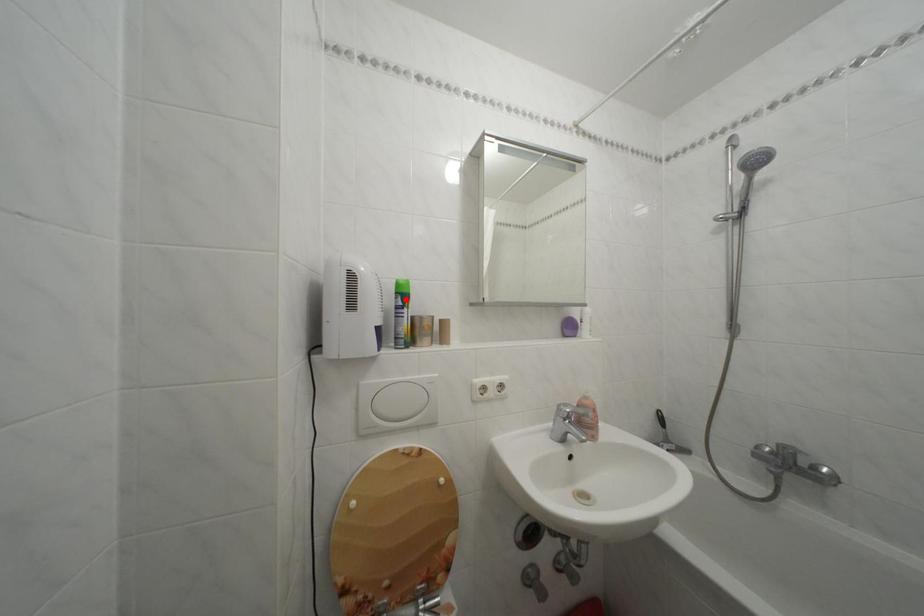
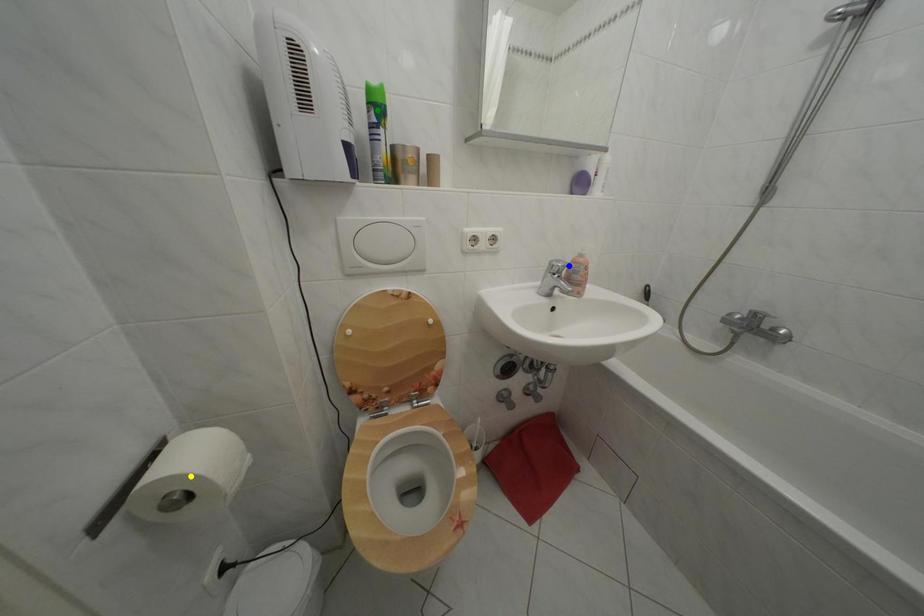
Question: I am providing you with two images of the same scene from different viewpoints. A red point is marked on the first image. You are given multiple points on the second image. Can you choose the point in image 2 that corresponds to the point in image 1?

Choices:
 (A) yellow point
 (B) blue point
 (C) green point

Answer: (C)